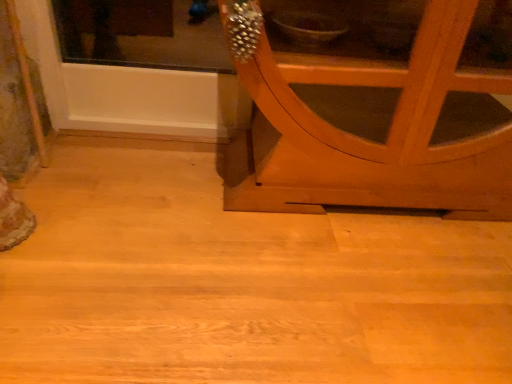
Question: Should I look upward or downward to see wooden cabinet at right?

Choices:
 (A) down
 (B) up

Answer: (B)